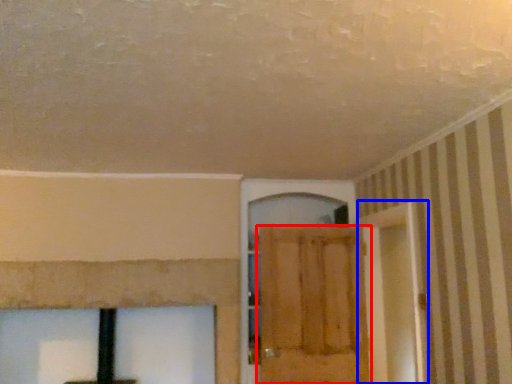
Question: Which object appears closest to the camera in this image, door (highlighted by a red box) or screen door (highlighted by a blue box)?

Choices:
 (A) door
 (B) screen door

Answer: (B)